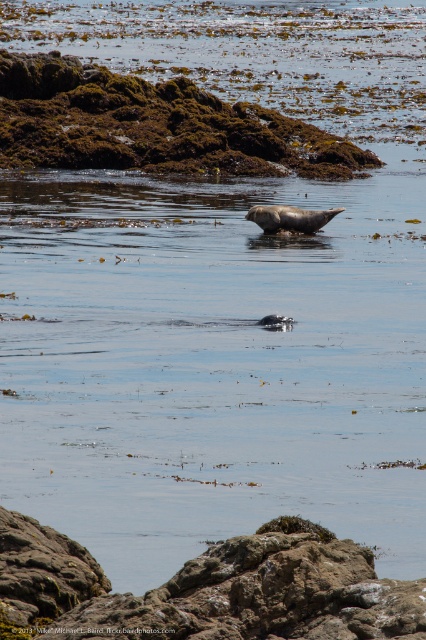
Does clear water at center appear on the left side of brown rough rock at center?

No, clear water at center is not to the left of brown rough rock at center.

Between clear water at center and brown rough rock at center, which one appears on the right side from the viewer's perspective?

clear water at center is more to the right.

The height and width of the screenshot is (640, 426). I want to click on clear water at center, so click(212, 362).

I want to click on clear water at center, so click(x=212, y=362).